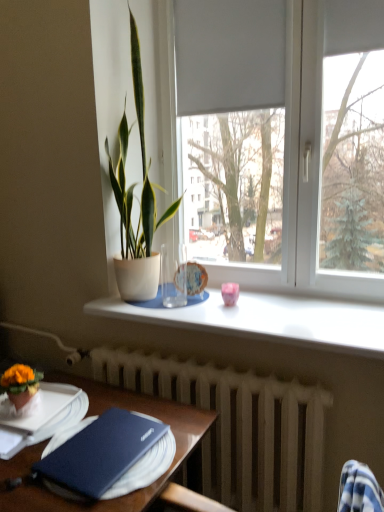
At what (x,y) coordinates should I click in order to perform the action: click on vacant space situated above white smooth window sill at center (from a real-world perspective). Please return your answer as a coordinate pair (x, y). Image resolution: width=384 pixels, height=512 pixels. Looking at the image, I should click on (233, 302).